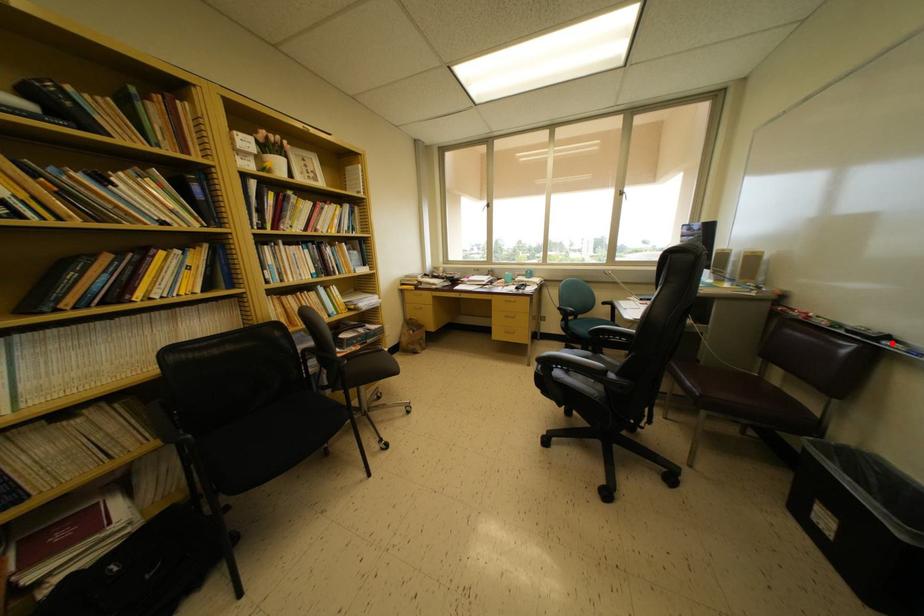
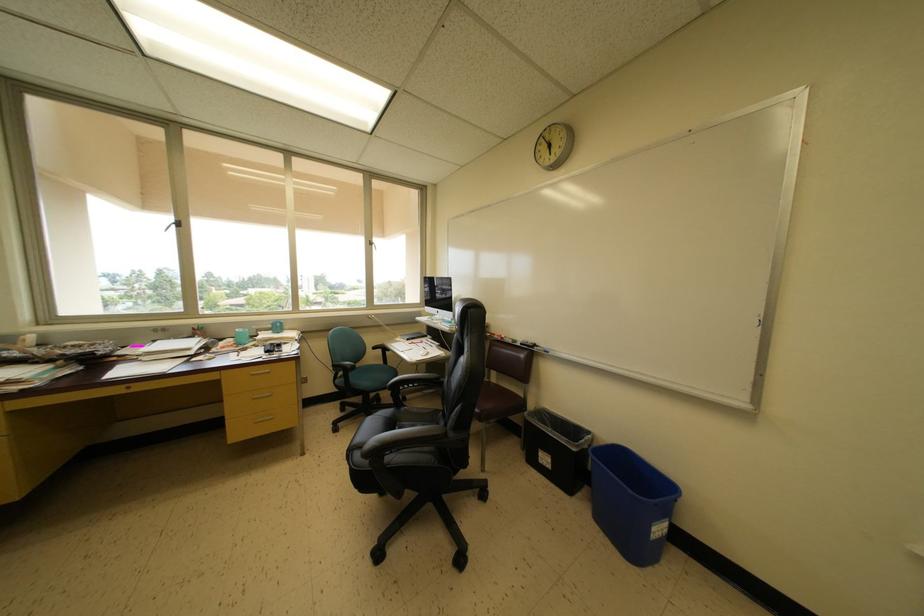
Where in the second image is the point corresponding to the highlighted location from the first image?

(539, 350)